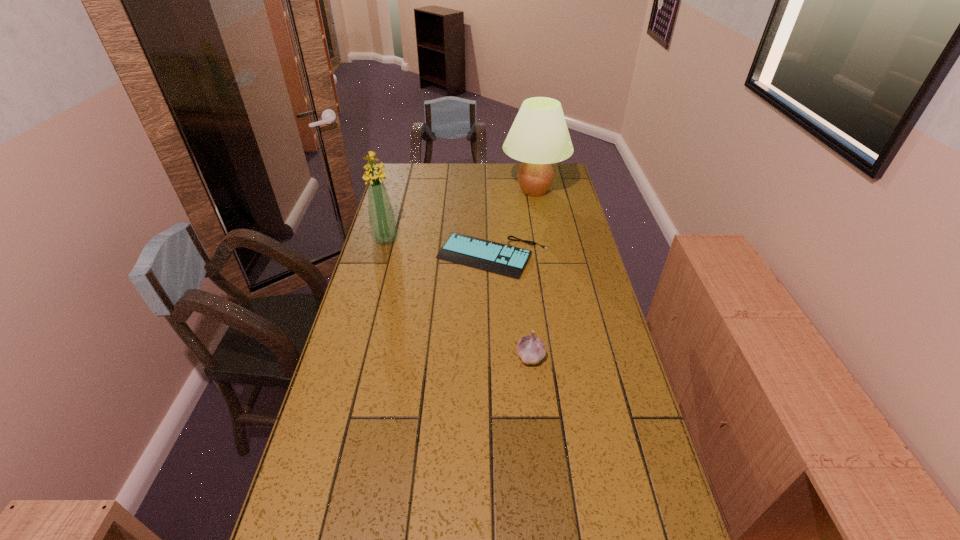
Locate an element on the screen. This screenshot has width=960, height=540. blank area located on the left of the shortest object is located at coordinates (404, 256).

The width and height of the screenshot is (960, 540). I want to click on object that is at the far edge, so click(539, 136).

Identify the location of object that is positioned at the left edge. The image size is (960, 540). (382, 223).

At what (x,y) coordinates should I click in order to perform the action: click on lampshade positioned at the right edge. Please return your answer as a coordinate pair (x, y). This screenshot has width=960, height=540. Looking at the image, I should click on (539, 136).

Where is `computer keyboard present at the right edge`? computer keyboard present at the right edge is located at coordinates (498, 258).

This screenshot has height=540, width=960. Find the location of `object that is at the far right corner`. object that is at the far right corner is located at coordinates (539, 136).

Locate an element on the screen. This screenshot has height=540, width=960. free space at the far edge of the desktop is located at coordinates (486, 187).

The height and width of the screenshot is (540, 960). I want to click on vacant space at the left edge, so click(291, 514).

What are the coordinates of `vacant space at the right edge of the desktop` in the screenshot? It's located at (618, 437).

Image resolution: width=960 pixels, height=540 pixels. I want to click on vacant area between the lampshade and the bouquet, so (460, 215).